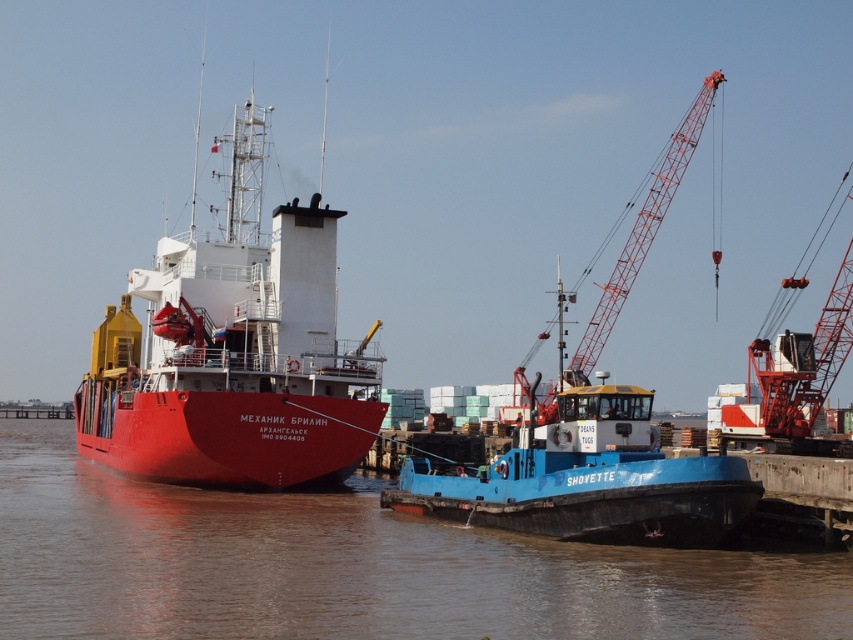
Question: Does brown matte water at lower left appear on the right side of shiny red ship at center?

Choices:
 (A) yes
 (B) no

Answer: (A)

Question: From the image, what is the correct spatial relationship of brown matte water at lower left in relation to blue matte tugboat at center?

Choices:
 (A) below
 (B) above

Answer: (A)

Question: Which of the following is the closest to the observer?

Choices:
 (A) orange metallic crane at upper right
 (B) blue matte tugboat at center

Answer: (B)

Question: Which of these objects is positioned closest to the shiny red ship at center?

Choices:
 (A) brown matte water at lower left
 (B) blue matte tugboat at center

Answer: (A)

Question: Which is farther from the blue matte tugboat at center?

Choices:
 (A) orange metallic crane at upper right
 (B) brown matte water at lower left

Answer: (A)

Question: Is shiny red ship at center in front of orange metallic crane at upper right?

Choices:
 (A) yes
 (B) no

Answer: (B)